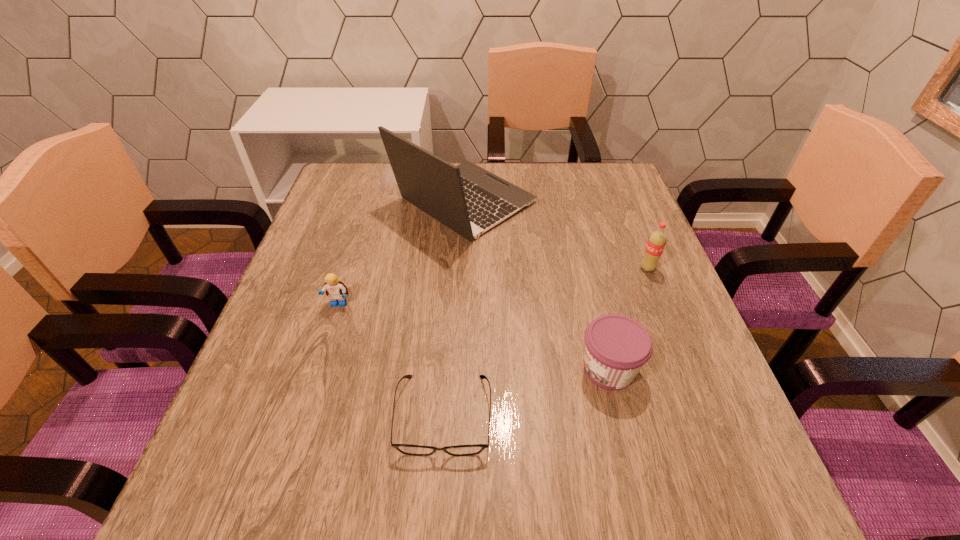
The image size is (960, 540). I want to click on the farthest object, so [468, 199].

This screenshot has height=540, width=960. In order to click on laptop_computer in this screenshot , I will do `click(468, 199)`.

The image size is (960, 540). I want to click on the second tallest object, so click(657, 240).

You are a GUI agent. You are given a task and a screenshot of the screen. Output one action in this format:
    pyautogui.click(x=<x>, y=<y>)
    Task: Click on the rightmost object
    This screenshot has height=540, width=960.
    Given the screenshot: What is the action you would take?
    pyautogui.click(x=657, y=240)

The width and height of the screenshot is (960, 540). Identify the location of the second object from right to left. (616, 347).

The width and height of the screenshot is (960, 540). I want to click on the third farthest object, so click(x=336, y=290).

I want to click on Lego, so click(336, 290).

I want to click on the shortest object, so click(416, 450).

You are a GUI agent. You are given a task and a screenshot of the screen. Output one action in this format:
    pyautogui.click(x=<x>, y=<y>)
    Task: Click on the vacant area located at the front screen of the farthest object
    This screenshot has width=960, height=540.
    Given the screenshot: What is the action you would take?
    tap(594, 202)

Locate an element on the screen. The width and height of the screenshot is (960, 540). vacant position located 0.390m on the back of the soda is located at coordinates (611, 176).